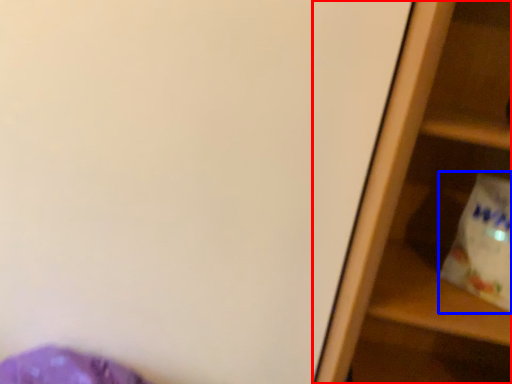
Question: Which object is further to the camera taking this photo, shelf (highlighted by a red box) or grocery bag (highlighted by a blue box)?

Choices:
 (A) shelf
 (B) grocery bag

Answer: (B)